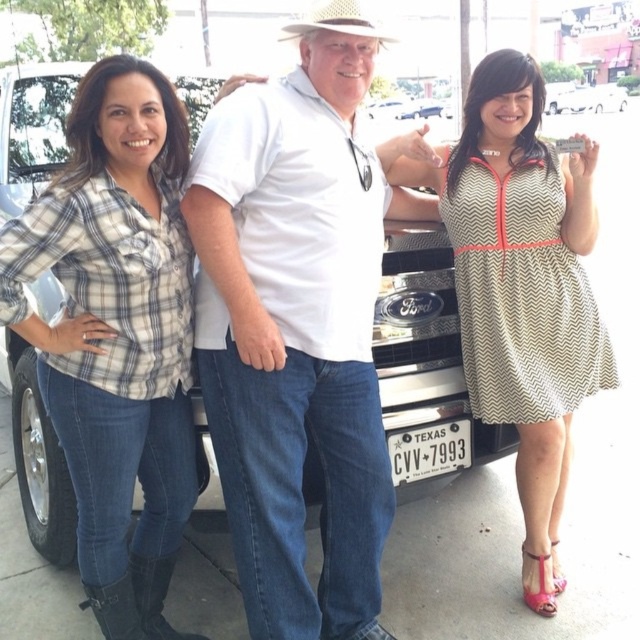
Question: Based on their relative distances, which object is farther from the strawhat at center?

Choices:
 (A) white metallic truck at center
 (B) chevron-patterned dress at center
 (C) plaid cotton shirt at left

Answer: (A)

Question: Can you confirm if plaid cotton shirt at left is wider than black metal license plate at lower center?

Choices:
 (A) yes
 (B) no

Answer: (A)

Question: Which of the following is the closest to the observer?

Choices:
 (A) (580, 99)
 (B) (106, 246)
 (C) (356, 19)

Answer: (B)

Question: Does chevron-patterned dress at center come in front of white metallic truck at center?

Choices:
 (A) yes
 (B) no

Answer: (A)

Question: Among these objects, which one is nearest to the camera?

Choices:
 (A) chevron-patterned dress at center
 (B) white metallic truck at center

Answer: (A)

Question: Is strawhat at center bigger than white glossy car at upper right?

Choices:
 (A) no
 (B) yes

Answer: (A)